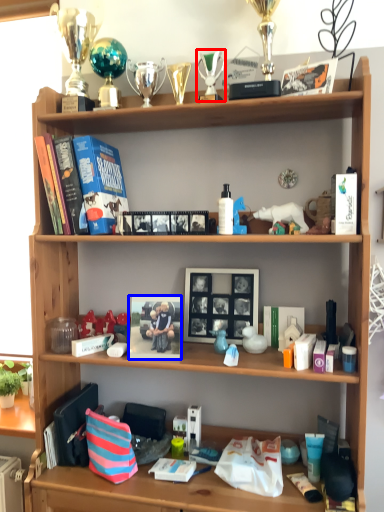
Question: Among these objects, which one is nearest to the camera, toy (highlighted by a red box) or book cover (highlighted by a blue box)?

Choices:
 (A) toy
 (B) book cover

Answer: (B)